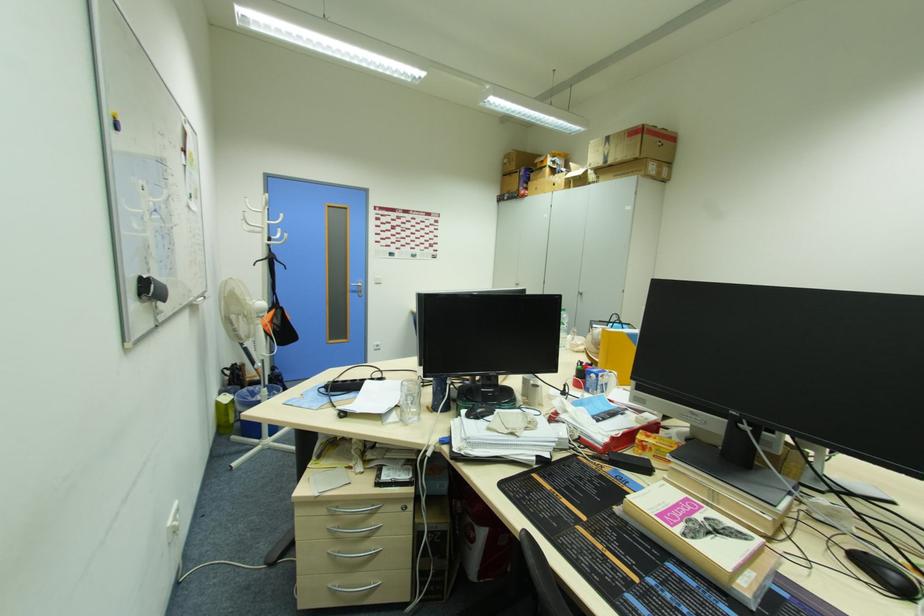
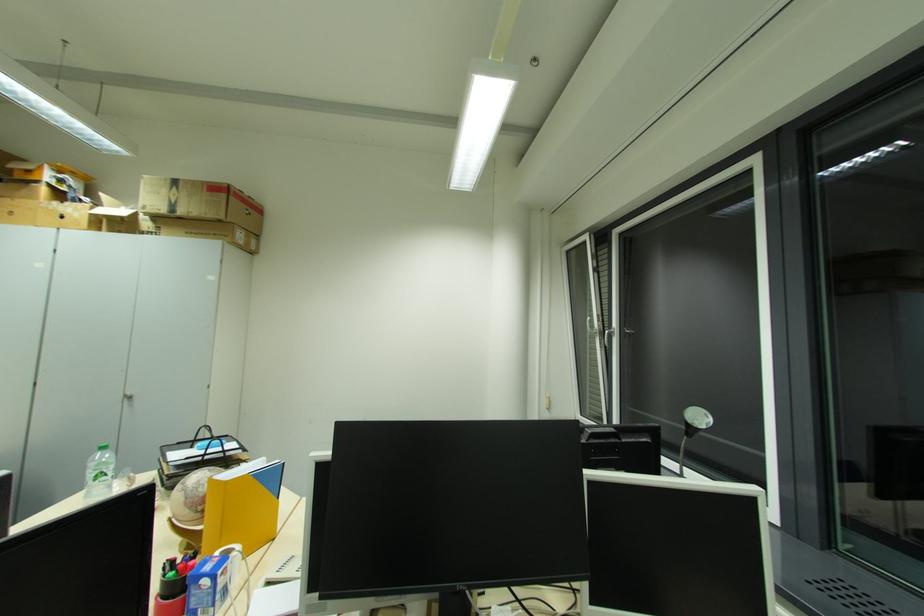
Question: I am providing you with two images of the same scene from different viewpoints. After the viewpoint changes to image2, which objects are now occluded?

Choices:
 (A) plastic water bottle
 (B) letter tray handle
 (C) window handle
 (D) none of these

Answer: (D)